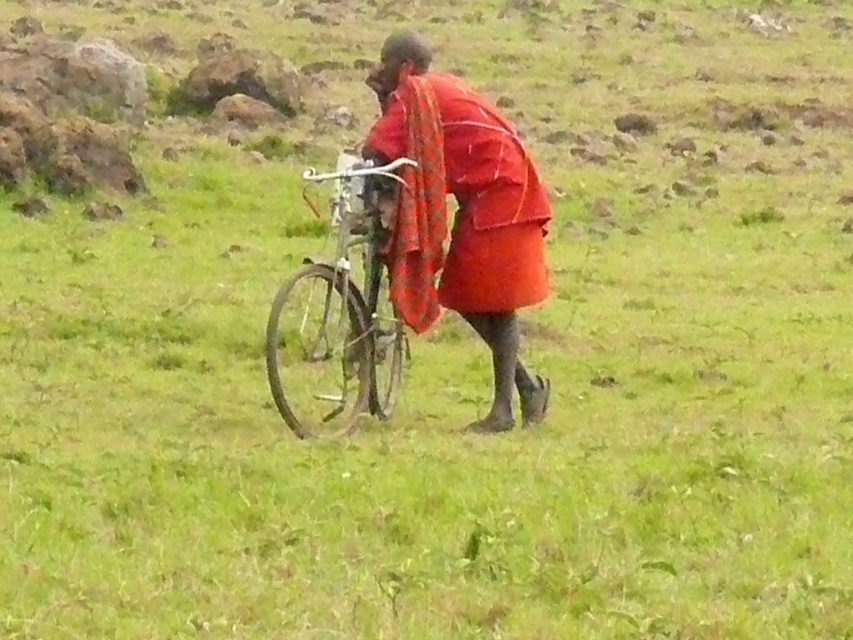
Describe the element at coordinates (461, 216) in the screenshot. I see `red woven cloth at center` at that location.

Is red woven cloth at center above silver metallic bicycle at center?

Indeed, red woven cloth at center is positioned over silver metallic bicycle at center.

The image size is (853, 640). Identify the location of red woven cloth at center. (461, 216).

What are the coordinates of `red woven cloth at center` in the screenshot? It's located at (461, 216).